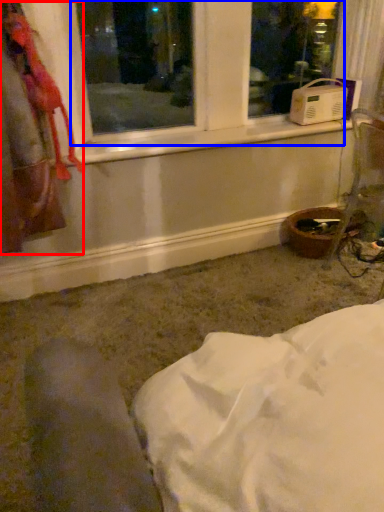
Question: Which point is closer to the camera, laundry (highlighted by a red box) or bay window (highlighted by a blue box)?

Choices:
 (A) laundry
 (B) bay window

Answer: (A)